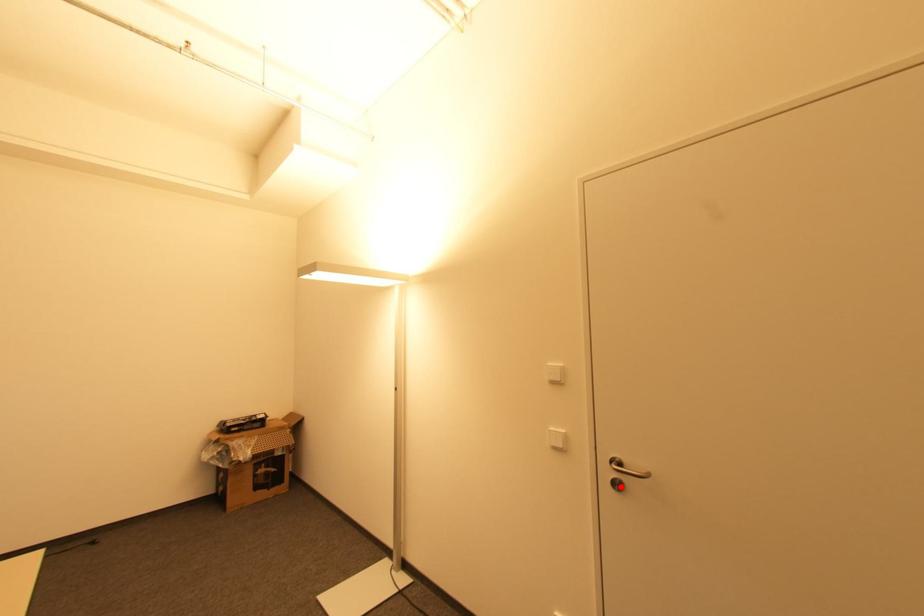
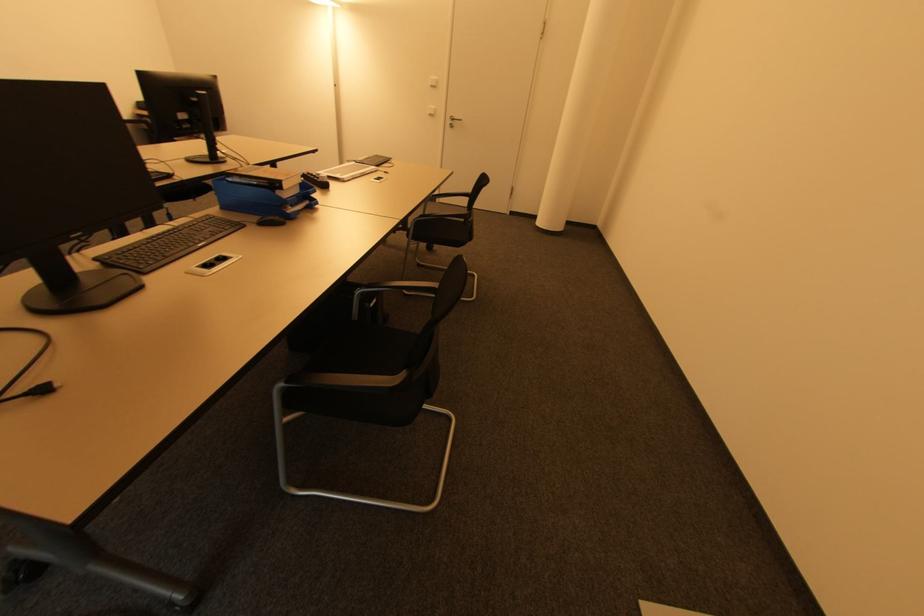
Question: I am providing you with two images of the same scene from different viewpoints. A red point is shown in image1. For the corresponding object point in image2, is it positioned nearer or farther from the camera?

Choices:
 (A) Nearer
 (B) Farther

Answer: (A)